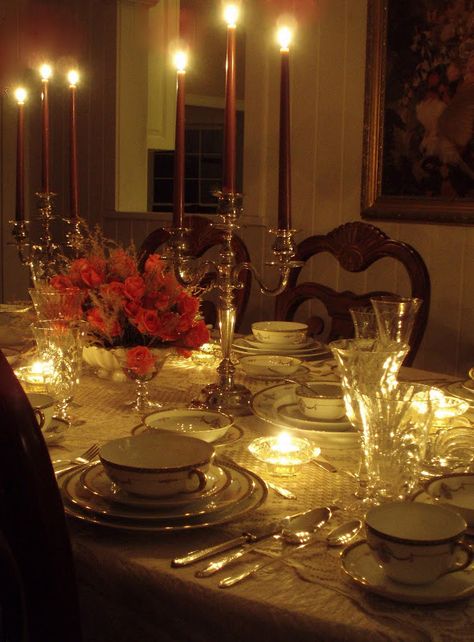
Where is `candle`? candle is located at coordinates (21, 212), (48, 177), (74, 185), (176, 185), (230, 166), (285, 187).